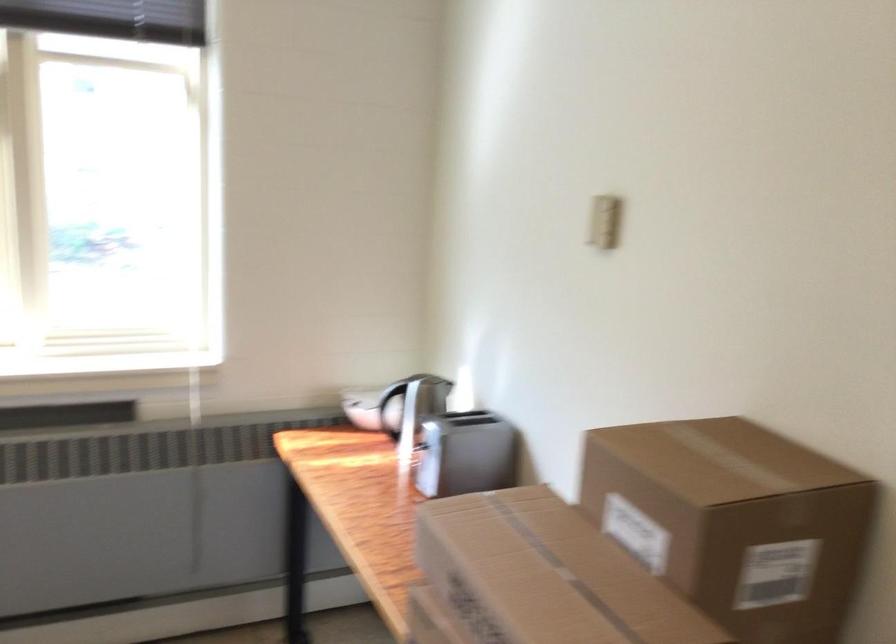
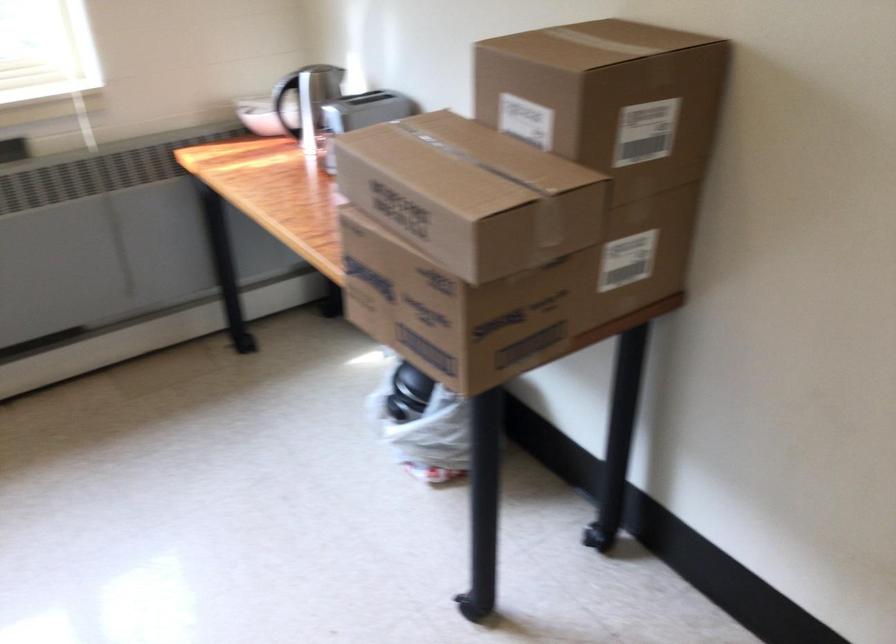
The point at (392, 404) is marked in the first image. Where is the corresponding point in the second image?

(285, 100)